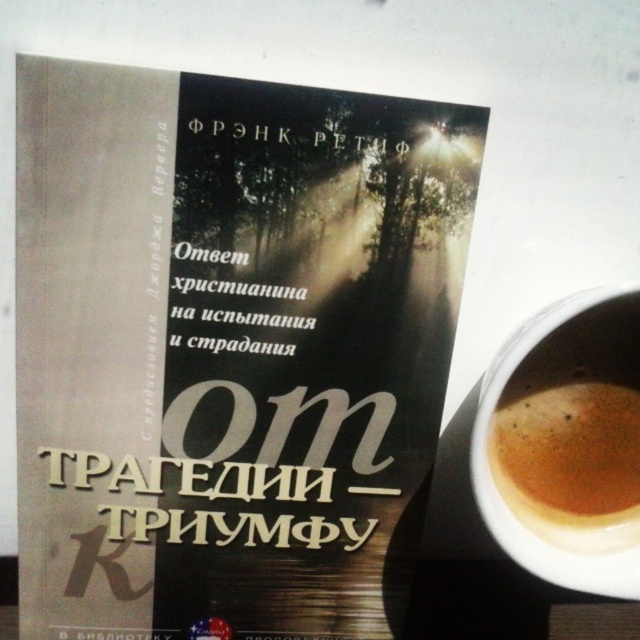
Does brown frothy coffee at lower right have a lesser width compared to brown frothy coffee at right?

Correct, brown frothy coffee at lower right's width is less than brown frothy coffee at right's.

Does point (604, 484) come farther from viewer compared to point (593, 292)?

Yes, it is behind point (593, 292).

At what (x,y) coordinates should I click in order to perform the action: click on brown frothy coffee at lower right. Please return your answer as a coordinate pair (x, y). Looking at the image, I should click on (570, 461).

Does point (84, 362) come farther from viewer compared to point (609, 392)?

No, it is not.

Is point (32, 637) less distant than point (502, 416)?

No, (32, 637) is further to viewer.

Is point (324, 499) behind point (588, 500)?

Yes, it is.

Identify the location of matte paper book at center. (228, 349).

Is matte paper book at center behind brown frothy coffee at right?

That is False.

Can you confirm if matte paper book at center is smaller than brown frothy coffee at right?

Incorrect, matte paper book at center is not smaller in size than brown frothy coffee at right.

Is point (417, 147) behind point (480, 433)?

No, (417, 147) is closer to viewer.

The image size is (640, 640). Find the location of `matte paper book at center`. matte paper book at center is located at coordinates (228, 349).